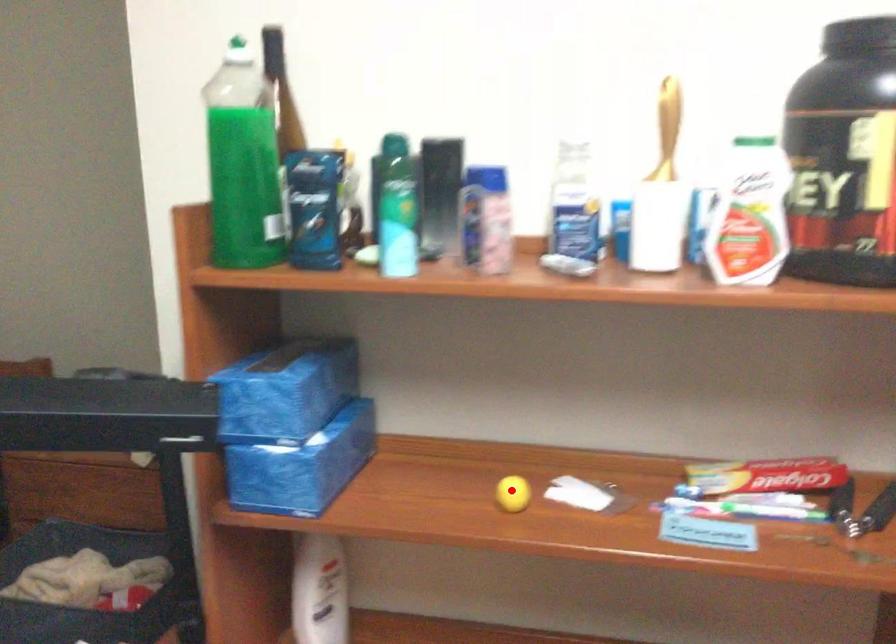
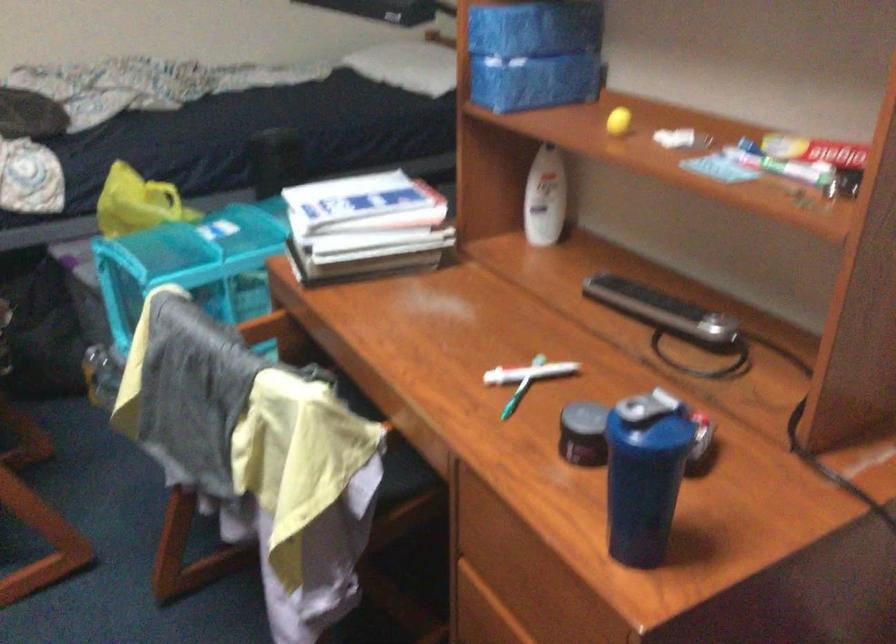
In the second image, find the point that corresponds to the highlighted location in the first image.

(617, 120)